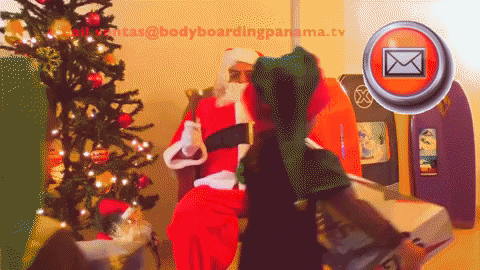
I want to click on christmas tree, so click(x=18, y=172).